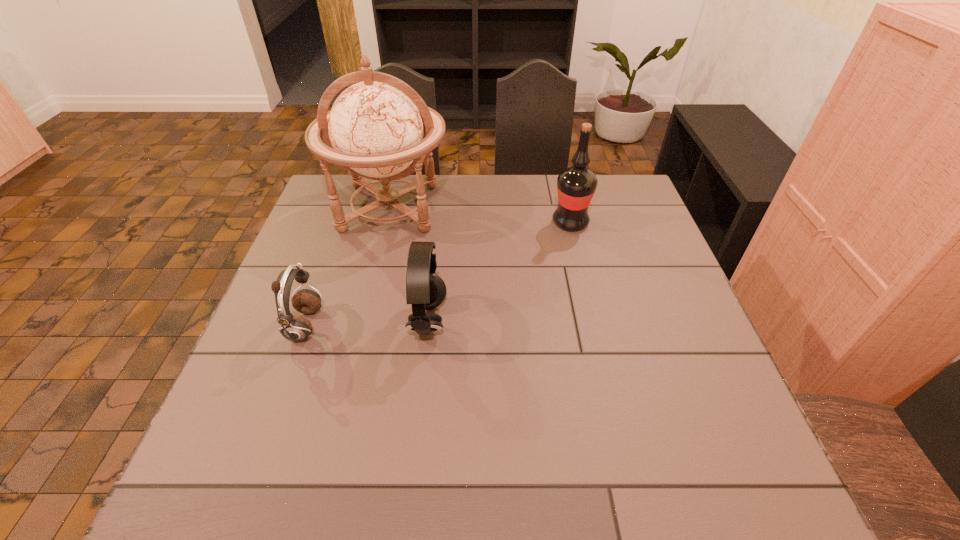
This screenshot has width=960, height=540. I want to click on empty location between the globe and the left earphone, so click(x=348, y=267).

I want to click on vacant space that is in between the wine bottle and the third tallest object, so click(499, 272).

Identify which object is the second closest to the globe. Please provide its 2D coordinates. Your answer should be formatted as a tuple, i.e. [(x, y)], where the tuple contains the x and y coordinates of a point satisfying the conditions above.

[(295, 328)]

Locate an element on the screen. object that can be found as the closest to the taller earphone is located at coordinates (375, 130).

Where is `vacant area that satisfies the following two spatial constraints: 1. at the front of the rightmost object showing Africa; 2. on the left side of the globe`? vacant area that satisfies the following two spatial constraints: 1. at the front of the rightmost object showing Africa; 2. on the left side of the globe is located at coordinates (386, 222).

Where is `free location that satisfies the following two spatial constraints: 1. at the front of the globe showing Africa; 2. on the ear pads of the shorter earphone`? Image resolution: width=960 pixels, height=540 pixels. free location that satisfies the following two spatial constraints: 1. at the front of the globe showing Africa; 2. on the ear pads of the shorter earphone is located at coordinates (360, 326).

Find the location of a particular element. The width and height of the screenshot is (960, 540). free space that satisfies the following two spatial constraints: 1. at the front of the tallest object showing Africa; 2. on the right side of the rightmost object is located at coordinates (386, 222).

You are a GUI agent. You are given a task and a screenshot of the screen. Output one action in this format:
    pyautogui.click(x=<x>, y=<y>)
    Task: Click on the free location that satisfies the following two spatial constraints: 1. at the front of the wine bottle showing Africa; 2. on the left side of the globe
    This screenshot has height=540, width=960.
    Given the screenshot: What is the action you would take?
    coord(386,222)

Where is `free space that satisfies the following two spatial constraints: 1. at the front of the tallest object showing Africa; 2. on the ear pads of the shortest object`? free space that satisfies the following two spatial constraints: 1. at the front of the tallest object showing Africa; 2. on the ear pads of the shortest object is located at coordinates (360, 326).

Locate an element on the screen. The image size is (960, 540). free space that satisfies the following two spatial constraints: 1. at the front of the wine bottle showing Africa; 2. on the left side of the globe is located at coordinates (386, 222).